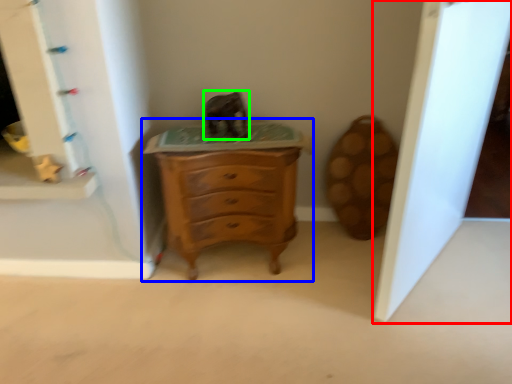
Question: Considering the real-world distances, which object is farthest from glass door (highlighted by a red box)? chest of drawers (highlighted by a blue box) or animal (highlighted by a green box)?

Choices:
 (A) chest of drawers
 (B) animal

Answer: (B)